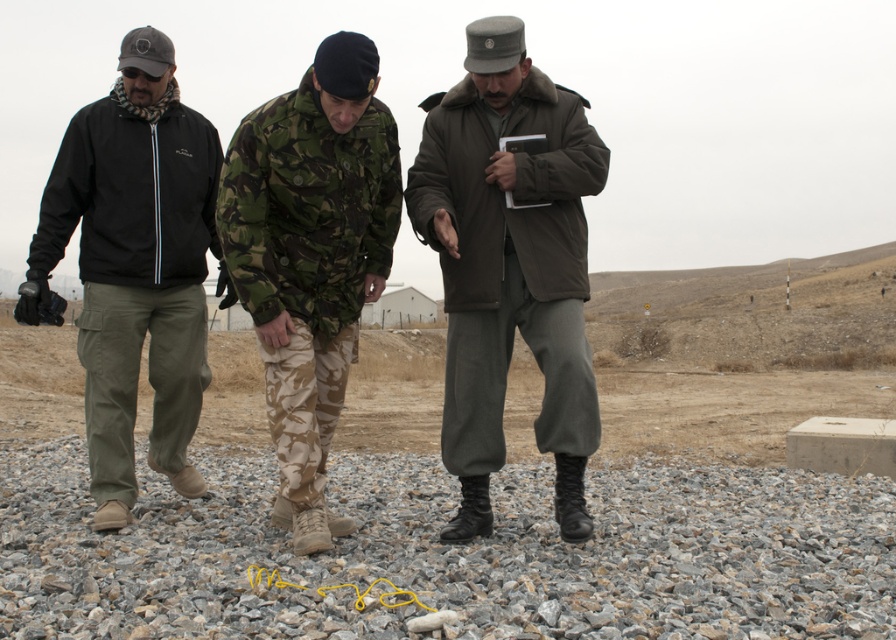
Between point (109, 518) and point (306, 484), which one is positioned in front?

Positioned in front is point (306, 484).

Does matte black jacket at left have a smaller size compared to camouflage fabric uniform at center?

Actually, matte black jacket at left might be larger than camouflage fabric uniform at center.

The height and width of the screenshot is (640, 896). What are the coordinates of `matte black jacket at left` in the screenshot? It's located at (134, 266).

Who is shorter, matte brown jacket at center or matte black jacket at left?

With less height is matte brown jacket at center.

Does point (553, 84) lie in front of point (112, 496)?

Yes, point (553, 84) is in front of point (112, 496).

The width and height of the screenshot is (896, 640). Identify the location of matte brown jacket at center. (509, 264).

Locate an element on the screen. The height and width of the screenshot is (640, 896). gray gravel at center is located at coordinates (449, 554).

Is gray gravel at center positioned at the back of camouflage fabric uniform at center?

Yes, gray gravel at center is behind camouflage fabric uniform at center.

Which is behind, point (886, 544) or point (299, 380)?

The point (886, 544) is behind.

Find the location of a particular element. gray gravel at center is located at coordinates (449, 554).